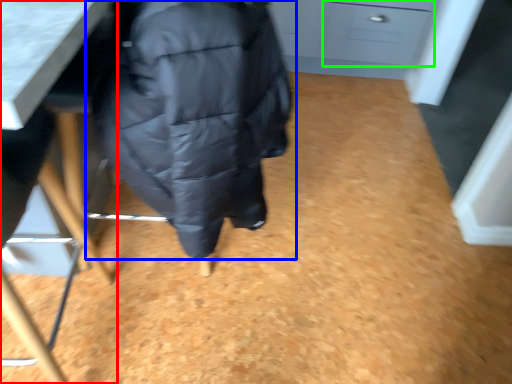
Question: Estimate the real-world distances between objects in this image. Which object is closer to furniture (highlighted by a red box), jacket (highlighted by a blue box) or drawer (highlighted by a green box)?

Choices:
 (A) jacket
 (B) drawer

Answer: (A)